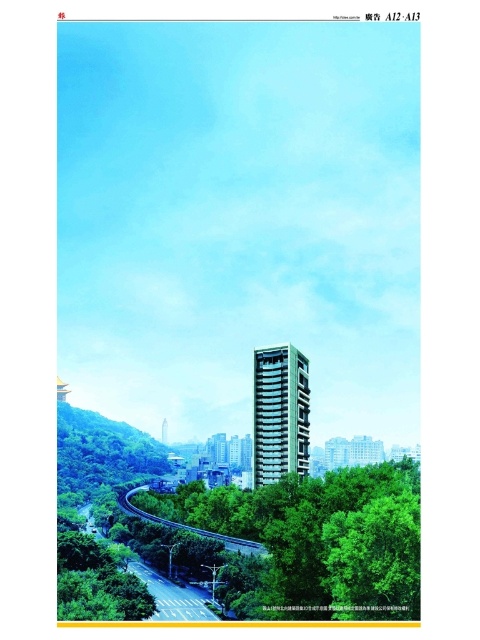
Between green leafy tree at lower center and sandy beige concrete building at center, which one has more height?

sandy beige concrete building at center

Is green leafy tree at lower center shorter than sandy beige concrete building at center?

Indeed, green leafy tree at lower center has a lesser height compared to sandy beige concrete building at center.

Identify the location of green leafy tree at lower center. (314, 541).

Where is `green leafy tree at lower center`? This screenshot has height=640, width=480. green leafy tree at lower center is located at coordinates (314, 541).